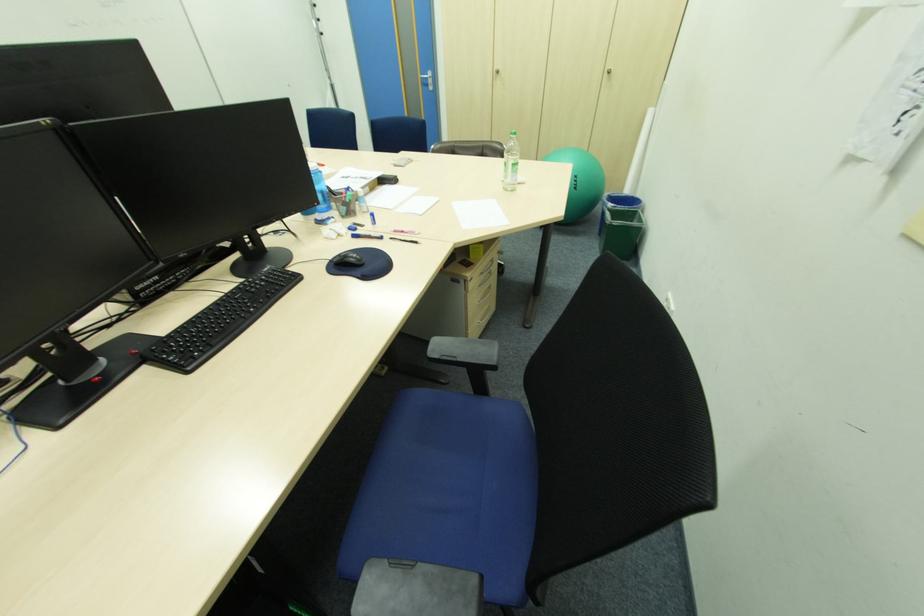
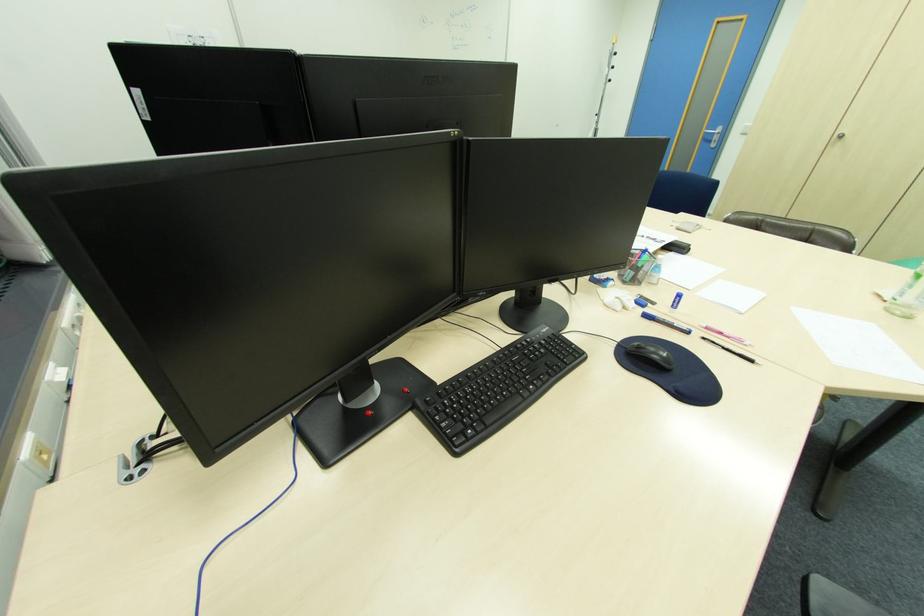
The point at (256, 281) is marked in the first image. Where is the corresponding point in the second image?

(533, 339)